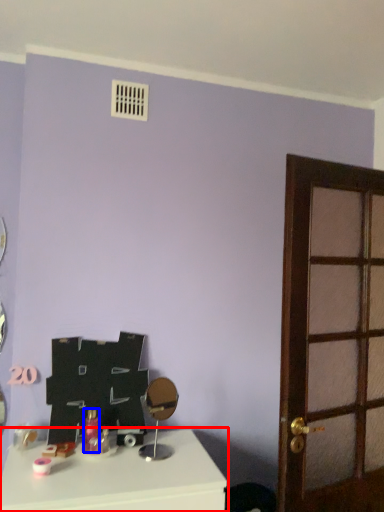
Question: Which object appears closest to the camera in this image, table (highlighted by a red box) or toiletry (highlighted by a blue box)?

Choices:
 (A) table
 (B) toiletry

Answer: (A)